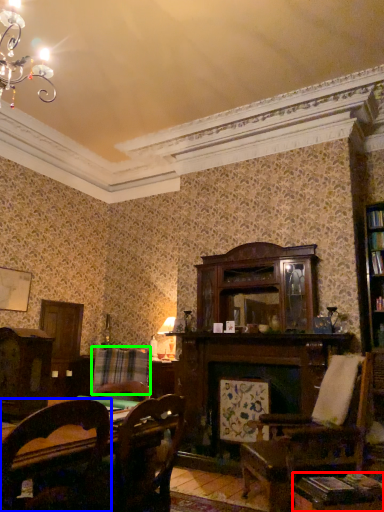
Question: Based on their relative distances, which object is nearer to table (highlighted by a red box)? Choose from chair (highlighted by a blue box) and plaid (highlighted by a green box).

Choices:
 (A) chair
 (B) plaid

Answer: (A)